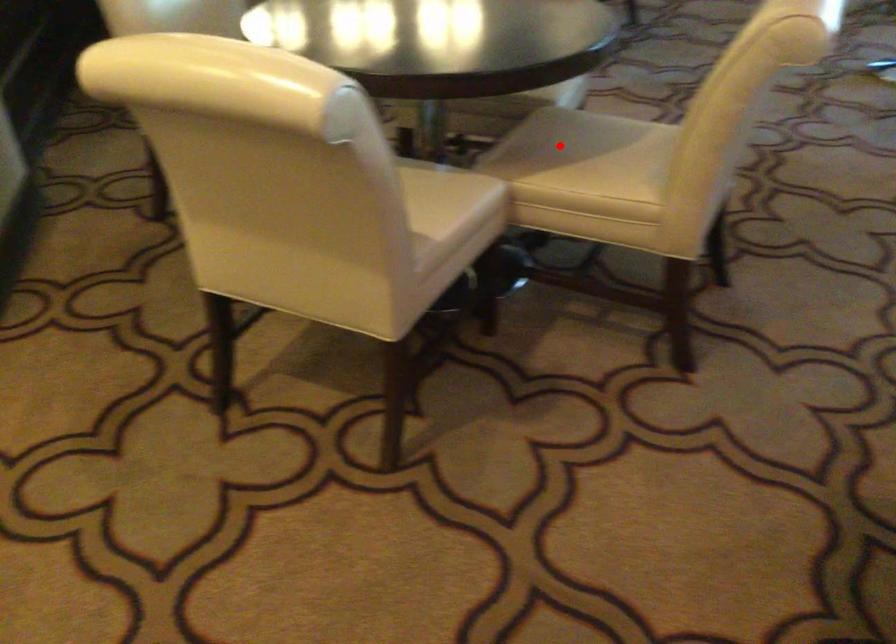
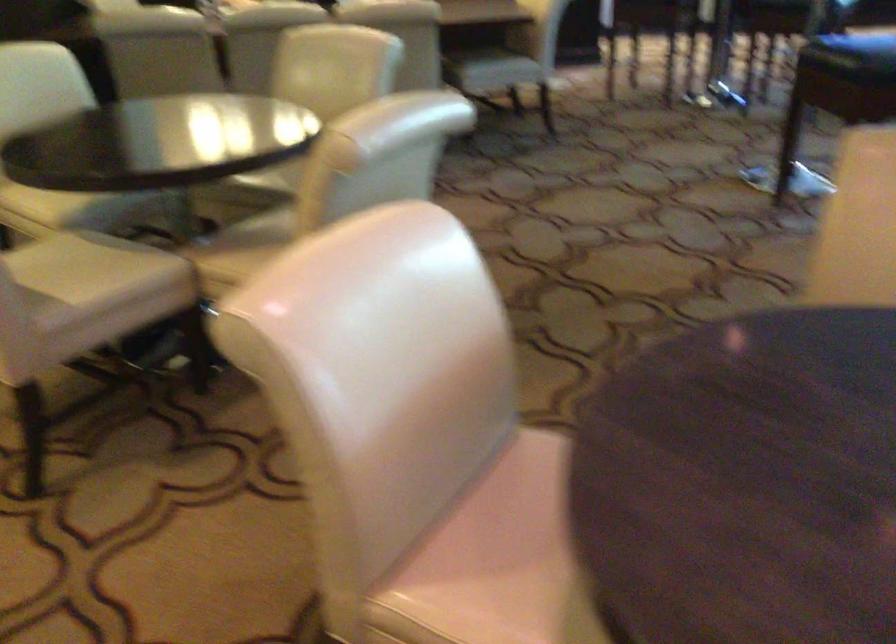
Find the pixel in the second image that matches the highlighted location in the first image.

(259, 234)